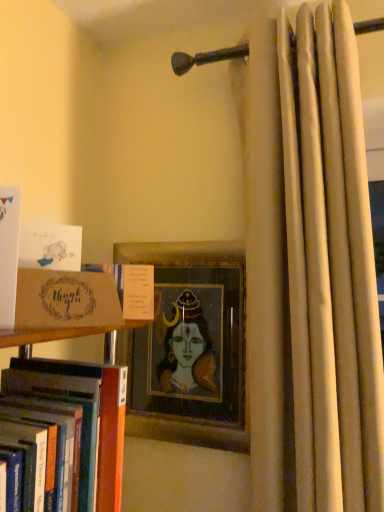
Question: Is white matte card at left, arranged as the 2th book when viewed from the top, taller than wooden picture frame at center?

Choices:
 (A) yes
 (B) no

Answer: (B)

Question: From a real-world perspective, is white matte card at left, which is the third book from bottom to top, beneath wooden picture frame at center?

Choices:
 (A) yes
 (B) no

Answer: (B)

Question: Does white matte card at left, which is the third book from bottom to top, turn towards wooden picture frame at center?

Choices:
 (A) no
 (B) yes

Answer: (A)

Question: From the image's perspective, is white matte card at left, which is the third book from bottom to top, under wooden picture frame at center?

Choices:
 (A) yes
 (B) no

Answer: (B)

Question: From a real-world perspective, is white matte card at left, which is the third book from bottom to top, positioned over wooden picture frame at center based on gravity?

Choices:
 (A) no
 (B) yes

Answer: (B)

Question: Does white matte card at left, which is the third book from bottom to top, appear on the left side of wooden picture frame at center?

Choices:
 (A) no
 (B) yes

Answer: (B)

Question: From the image's perspective, is hardcover book at center, arranged as the 4th book when viewed from the top, above white matte card at left, which is the third book from bottom to top?

Choices:
 (A) yes
 (B) no

Answer: (B)

Question: Is hardcover book at center, marked as the 1th book in a bottom-to-top arrangement, facing away from white matte card at left, arranged as the 2th book when viewed from the top?

Choices:
 (A) yes
 (B) no

Answer: (B)

Question: From the image's perspective, is hardcover book at center, arranged as the 4th book when viewed from the top, beneath white matte card at left, arranged as the 2th book when viewed from the top?

Choices:
 (A) yes
 (B) no

Answer: (A)

Question: Considering the relative positions of hardcover book at center, arranged as the 4th book when viewed from the top, and white matte card at left, arranged as the 2th book when viewed from the top, in the image provided, is hardcover book at center, arranged as the 4th book when viewed from the top, behind white matte card at left, arranged as the 2th book when viewed from the top,?

Choices:
 (A) yes
 (B) no

Answer: (B)

Question: From a real-world perspective, is hardcover book at center, arranged as the 4th book when viewed from the top, over white matte card at left, arranged as the 2th book when viewed from the top?

Choices:
 (A) yes
 (B) no

Answer: (B)

Question: Considering the relative sizes of hardcover book at center, arranged as the 4th book when viewed from the top, and white matte card at left, which is the third book from bottom to top, in the image provided, is hardcover book at center, arranged as the 4th book when viewed from the top, wider than white matte card at left, which is the third book from bottom to top,?

Choices:
 (A) yes
 (B) no

Answer: (A)

Question: Is matte brown card at left surrounded by beige fabric curtain at right?

Choices:
 (A) no
 (B) yes

Answer: (A)